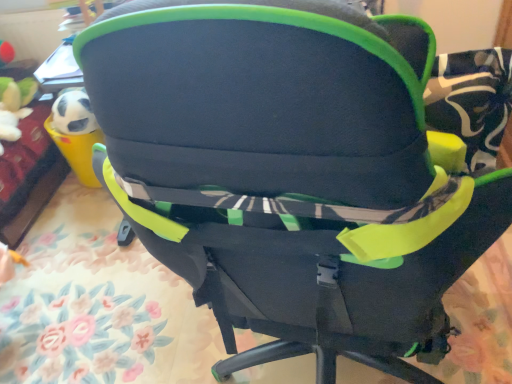
This screenshot has height=384, width=512. What do you see at coordinates (73, 113) in the screenshot?
I see `white plush toy at upper left` at bounding box center [73, 113].

Where is `white plush toy at upper left`? The width and height of the screenshot is (512, 384). white plush toy at upper left is located at coordinates (73, 113).

Measure the distance between white plush toy at upper left and camera.

white plush toy at upper left and camera are 5.67 feet apart.

What is the approximate height of white plush toy at upper left?

It is 16.51 centimeters.

This screenshot has width=512, height=384. I want to click on white plush toy at upper left, so click(x=73, y=113).